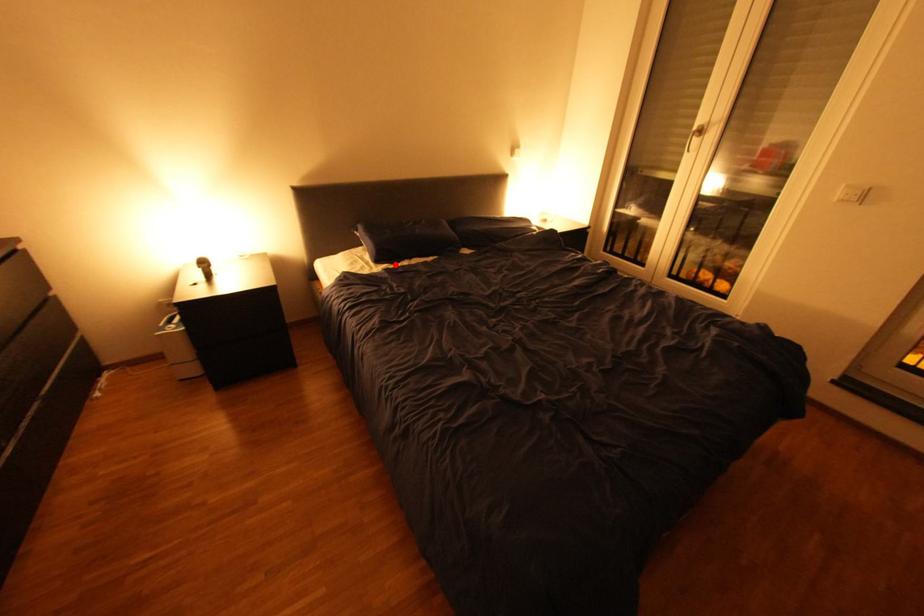
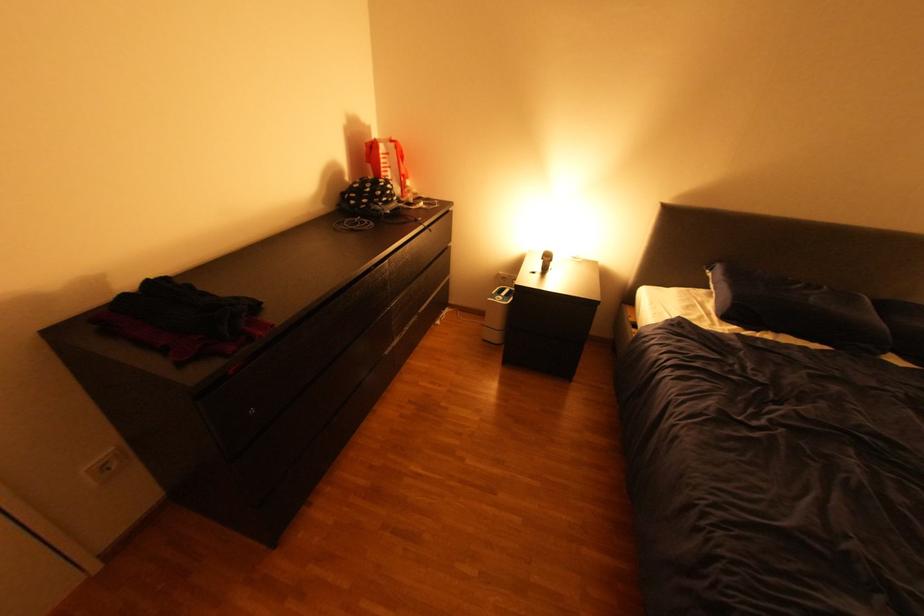
The point at the highlighted location is marked in the first image. Where is the corresponding point in the second image?

(745, 326)